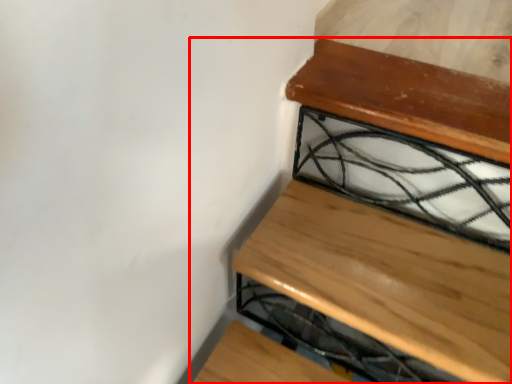
Question: Considering the relative positions of furniture (annotated by the red box) and glass window in the image provided, where is furniture (annotated by the red box) located with respect to the staircase?

Choices:
 (A) right
 (B) left

Answer: (B)